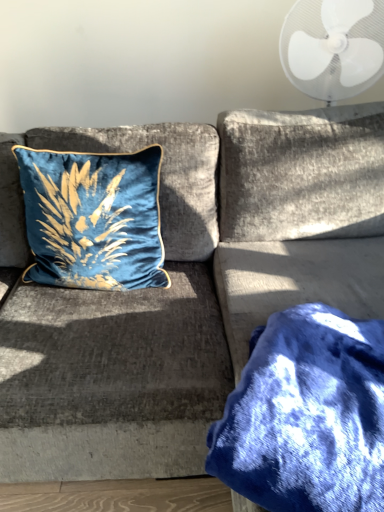
Question: Can you confirm if white plastic fan at upper right is positioned to the left of blue fuzzy blanket at lower right?

Choices:
 (A) no
 (B) yes

Answer: (A)

Question: Can you confirm if white plastic fan at upper right is positioned to the right of blue fuzzy blanket at lower right?

Choices:
 (A) no
 (B) yes

Answer: (B)

Question: Does white plastic fan at upper right have a larger size compared to blue fuzzy blanket at lower right?

Choices:
 (A) no
 (B) yes

Answer: (B)

Question: Is white plastic fan at upper right positioned in front of blue fuzzy blanket at lower right?

Choices:
 (A) no
 (B) yes

Answer: (A)

Question: Is blue fuzzy blanket at lower right inside white plastic fan at upper right?

Choices:
 (A) no
 (B) yes

Answer: (A)

Question: Is white plastic fan at upper right looking in the opposite direction of blue fuzzy blanket at lower right?

Choices:
 (A) yes
 (B) no

Answer: (B)

Question: From the image's perspective, is velvet blue pillow at upper left above white plastic fan at upper right?

Choices:
 (A) yes
 (B) no

Answer: (B)

Question: Is the depth of velvet blue pillow at upper left less than that of white plastic fan at upper right?

Choices:
 (A) yes
 (B) no

Answer: (A)

Question: From a real-world perspective, is velvet blue pillow at upper left under white plastic fan at upper right?

Choices:
 (A) yes
 (B) no

Answer: (A)

Question: From a real-world perspective, is velvet blue pillow at upper left located higher than white plastic fan at upper right?

Choices:
 (A) no
 (B) yes

Answer: (A)

Question: Does velvet blue pillow at upper left turn towards white plastic fan at upper right?

Choices:
 (A) yes
 (B) no

Answer: (B)

Question: Is velvet blue pillow at upper left oriented away from white plastic fan at upper right?

Choices:
 (A) yes
 (B) no

Answer: (B)

Question: Is blue fuzzy blanket at lower right facing away from velvet blue pillow at upper left?

Choices:
 (A) yes
 (B) no

Answer: (B)